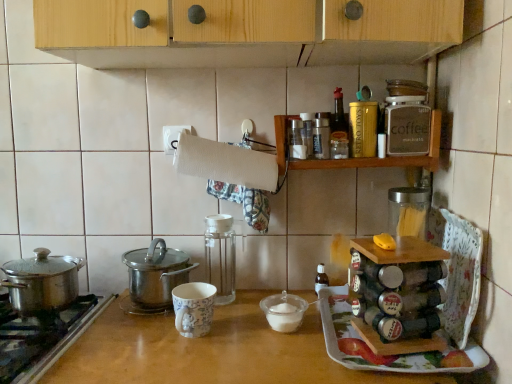
Describe the element at coordinates (398, 294) in the screenshot. The width and height of the screenshot is (512, 384). I see `metallic silver spice rack at center right, which ranks as the second appliance in left-to-right order` at that location.

What is the approximate height of shiny metallic pot at left, positioned as the sixth kitchen appliance in right-to-left order?

shiny metallic pot at left, positioned as the sixth kitchen appliance in right-to-left order, is 7.45 inches tall.

This screenshot has width=512, height=384. Find the location of `white plastic bowl at center, the 2th appliance positioned from the right`. white plastic bowl at center, the 2th appliance positioned from the right is located at coordinates (284, 311).

This screenshot has width=512, height=384. In order to click on porcelain floral mug at center in this screenshot , I will do `click(193, 308)`.

The image size is (512, 384). What do you see at coordinates (226, 163) in the screenshot? I see `white paper towel at upper center` at bounding box center [226, 163].

This screenshot has height=384, width=512. I want to click on metallic silver spice rack at center right, the first appliance when ordered from right to left, so click(398, 294).

From the image's perspective, is clear glass jar at upper right, the first kitchen appliance from the right, positioned above or below white plastic bowl at center, the 1th appliance viewed from the left?

clear glass jar at upper right, the first kitchen appliance from the right, is above white plastic bowl at center, the 1th appliance viewed from the left.

From the image's perspective, which appliance is the 2nd one below the clear glass jar at upper right, the seventh kitchen appliance in the left-to-right sequence? Please provide its 2D coordinates.

[(284, 311)]

Is clear glass jar at upper right, the seventh kitchen appliance in the left-to-right sequence, spatially inside white plastic bowl at center, the 2th appliance positioned from the right, or outside of it?

clear glass jar at upper right, the seventh kitchen appliance in the left-to-right sequence, cannot be found inside white plastic bowl at center, the 2th appliance positioned from the right.

Is clear glass jar at upper right, the first kitchen appliance from the right, positioned before white plastic bowl at center, the 2th appliance positioned from the right?

No.

Does point (330, 145) lie in front of point (195, 160)?

No, (330, 145) is behind (195, 160).

From the image's perspective, is metallic glass spice rack at upper center, which is counted as the 4th kitchen appliance, starting from the right, on white paper towel at upper center?

Yes.

In terms of height, does metallic glass spice rack at upper center, which is counted as the 4th kitchen appliance, starting from the right, look taller or shorter compared to white paper towel at upper center?

Considering their sizes, metallic glass spice rack at upper center, which is counted as the 4th kitchen appliance, starting from the right, has more height than white paper towel at upper center.

Does metallic glass spice rack at upper center, which is counted as the 4th kitchen appliance, starting from the right, have a larger size compared to white paper towel at upper center?

No, metallic glass spice rack at upper center, which is counted as the 4th kitchen appliance, starting from the right, is not bigger than white paper towel at upper center.

From the image's perspective, is metallic silver spice rack at center right, the first appliance when ordered from right to left, located beneath matte brown coffee container at upper right, placed as the second kitchen appliance when sorted from right to left?

Yes.

Is metallic silver spice rack at center right, the first appliance when ordered from right to left, at the right side of matte brown coffee container at upper right, which appears as the 6th kitchen appliance when viewed from the left?

No.

Who is taller, metallic silver spice rack at center right, which ranks as the second appliance in left-to-right order, or matte brown coffee container at upper right, which appears as the 6th kitchen appliance when viewed from the left?

With more height is metallic silver spice rack at center right, which ranks as the second appliance in left-to-right order.

Considering the relative sizes of metallic silver spice rack at center right, which ranks as the second appliance in left-to-right order, and matte brown coffee container at upper right, placed as the second kitchen appliance when sorted from right to left, in the image provided, is metallic silver spice rack at center right, which ranks as the second appliance in left-to-right order, wider than matte brown coffee container at upper right, placed as the second kitchen appliance when sorted from right to left,?

Yes.

From a real-world perspective, which is physically below, white paper towel at upper center or matte brown coffee container at upper right, which appears as the 6th kitchen appliance when viewed from the left?

In real-world perspective, white paper towel at upper center is lower.

Based on the photo, does white paper towel at upper center turn towards matte brown coffee container at upper right, placed as the second kitchen appliance when sorted from right to left?

No, white paper towel at upper center is not aimed at matte brown coffee container at upper right, placed as the second kitchen appliance when sorted from right to left.

From the image's perspective, count 2nd kitchen appliances upward from the white paper towel at upper center and point to it. Please provide its 2D coordinates.

[(407, 126)]

How different are the orientations of white paper towel at upper center and matte brown coffee container at upper right, placed as the second kitchen appliance when sorted from right to left, in degrees?

The facing directions of white paper towel at upper center and matte brown coffee container at upper right, placed as the second kitchen appliance when sorted from right to left, are 1.45 degrees apart.

Is the surface of metallic glass spice rack at upper center, which ranks as the 4th kitchen appliance in left-to-right order, in direct contact with porcelain floral mug at center?

No, metallic glass spice rack at upper center, which ranks as the 4th kitchen appliance in left-to-right order, is not touching porcelain floral mug at center.

Is metallic glass spice rack at upper center, which is counted as the 4th kitchen appliance, starting from the right, at the right side of porcelain floral mug at center?

Yes, metallic glass spice rack at upper center, which is counted as the 4th kitchen appliance, starting from the right, is to the right of porcelain floral mug at center.

From the image's perspective, is metallic glass spice rack at upper center, which is counted as the 4th kitchen appliance, starting from the right, above porcelain floral mug at center?

Yes, from the image's perspective, metallic glass spice rack at upper center, which is counted as the 4th kitchen appliance, starting from the right, is above porcelain floral mug at center.

Which is correct: metallic glass spice rack at upper center, which ranks as the 4th kitchen appliance in left-to-right order, is inside porcelain floral mug at center, or outside of it?

metallic glass spice rack at upper center, which ranks as the 4th kitchen appliance in left-to-right order, is not inside porcelain floral mug at center, it's outside.

Between metallic glass spice rack at upper center, which ranks as the 4th kitchen appliance in left-to-right order, and gold metallic canister at upper center, marked as the third kitchen appliance in a right-to-left arrangement, which one has more height?

With more height is metallic glass spice rack at upper center, which ranks as the 4th kitchen appliance in left-to-right order.

From the picture: How different are the orientations of metallic glass spice rack at upper center, which ranks as the 4th kitchen appliance in left-to-right order, and gold metallic canister at upper center, the fifth kitchen appliance when ordered from left to right, in degrees?

There is a 0.478-degree angle between the facing directions of metallic glass spice rack at upper center, which ranks as the 4th kitchen appliance in left-to-right order, and gold metallic canister at upper center, the fifth kitchen appliance when ordered from left to right.

Is metallic glass spice rack at upper center, which ranks as the 4th kitchen appliance in left-to-right order, beside gold metallic canister at upper center, the fifth kitchen appliance when ordered from left to right?

Yes, metallic glass spice rack at upper center, which ranks as the 4th kitchen appliance in left-to-right order, and gold metallic canister at upper center, the fifth kitchen appliance when ordered from left to right, clearly make contact.

Looking at this image, is metallic glass spice rack at upper center, which ranks as the 4th kitchen appliance in left-to-right order, to the right of polished stainless steel pot at left, which appears as the first kitchen appliance when viewed from the left, from the viewer's perspective?

Indeed, metallic glass spice rack at upper center, which ranks as the 4th kitchen appliance in left-to-right order, is positioned on the right side of polished stainless steel pot at left, which appears as the first kitchen appliance when viewed from the left.

Is metallic glass spice rack at upper center, which ranks as the 4th kitchen appliance in left-to-right order, turned away from polished stainless steel pot at left, the 7th kitchen appliance viewed from the right?

No.

The width and height of the screenshot is (512, 384). I want to click on the 3rd kitchen appliance to the left of the metallic glass spice rack at upper center, which is counted as the 4th kitchen appliance, starting from the right, starting your count from the anchor, so click(x=42, y=281).

Which object is wider, metallic glass spice rack at upper center, which ranks as the 4th kitchen appliance in left-to-right order, or polished stainless steel pot at left, the 7th kitchen appliance viewed from the right?

Wider between the two is polished stainless steel pot at left, the 7th kitchen appliance viewed from the right.

The height and width of the screenshot is (384, 512). Find the location of `the 1st kitchen appliance behind the white plastic bowl at center, the 2th appliance positioned from the right, starting your count from the anchor`. the 1st kitchen appliance behind the white plastic bowl at center, the 2th appliance positioned from the right, starting your count from the anchor is located at coordinates (405, 88).

This screenshot has height=384, width=512. Identify the location of kitchen appliance that is the 3rd one when counting upward from the white paper towel at upper center (from the image's perspective). (339, 129).

Estimate the real-world distances between objects in this image. Which object is closer to wooden spice rack at upper right, clear glass jar at upper right, the first kitchen appliance from the right, or white paper towel at upper center?

white paper towel at upper center lies closer to wooden spice rack at upper right than the other object.

Based on their spatial positions, is metallic silver spice rack at center right, which ranks as the second appliance in left-to-right order, or white paper towel at upper center further from stainless steel gas stove at lower left?

metallic silver spice rack at center right, which ranks as the second appliance in left-to-right order, is positioned further to the anchor stainless steel gas stove at lower left.

Estimate the real-world distances between objects in this image. Which object is further from shiny metallic pot at left, positioned as the sixth kitchen appliance in right-to-left order, clear glass jar at upper right, the first kitchen appliance from the right, or transparent glass spice rack at center, which is the 3th kitchen appliance from left to right?

The object further to shiny metallic pot at left, positioned as the sixth kitchen appliance in right-to-left order, is clear glass jar at upper right, the first kitchen appliance from the right.

From the image, which object appears to be nearer to white paper towel at upper center, gold metallic canister at upper center, the fifth kitchen appliance when ordered from left to right, or polished stainless steel pot at left, which appears as the first kitchen appliance when viewed from the left?

Based on the image, gold metallic canister at upper center, the fifth kitchen appliance when ordered from left to right, appears to be nearer to white paper towel at upper center.

Which object lies further to the anchor point gold metallic canister at upper center, marked as the third kitchen appliance in a right-to-left arrangement, white paper towel at upper center or porcelain floral mug at center?

porcelain floral mug at center lies further to gold metallic canister at upper center, marked as the third kitchen appliance in a right-to-left arrangement, than the other object.

From the image, which object appears to be nearer to metallic silver spice rack at center right, the first appliance when ordered from right to left, porcelain floral mug at center or gold metallic canister at upper center, marked as the third kitchen appliance in a right-to-left arrangement?

The object closer to metallic silver spice rack at center right, the first appliance when ordered from right to left, is gold metallic canister at upper center, marked as the third kitchen appliance in a right-to-left arrangement.

From the picture: Estimate the real-world distances between objects in this image. Which object is closer to stainless steel gas stove at lower left, gold metallic canister at upper center, the fifth kitchen appliance when ordered from left to right, or clear glass jar at upper right, the seventh kitchen appliance in the left-to-right sequence?

Among the two, gold metallic canister at upper center, the fifth kitchen appliance when ordered from left to right, is located nearer to stainless steel gas stove at lower left.

From the image, which object appears to be farther from metallic silver spice rack at center right, the first appliance when ordered from right to left, transparent glass spice rack at center, which is the 3th kitchen appliance from left to right, or clear glass jar at upper right, the first kitchen appliance from the right?

clear glass jar at upper right, the first kitchen appliance from the right.

This screenshot has height=384, width=512. What are the coordinates of `shelf between porcelain floral mug at center and matte brown coffee container at upper right, placed as the second kitchen appliance when sorted from right to left, from left to right` in the screenshot? It's located at (384, 158).

Find the location of `shelf between shiny metallic pot at left, marked as the second kitchen appliance in a left-to-right arrangement, and metallic silver spice rack at center right, which ranks as the second appliance in left-to-right order, in the horizontal direction`. shelf between shiny metallic pot at left, marked as the second kitchen appliance in a left-to-right arrangement, and metallic silver spice rack at center right, which ranks as the second appliance in left-to-right order, in the horizontal direction is located at coordinates (384, 158).

In order to click on shelf located between transparent glass spice rack at center, which is the 5th kitchen appliance in right-to-left order, and metallic silver spice rack at center right, the first appliance when ordered from right to left, in the left-right direction in this screenshot , I will do `click(384, 158)`.

I want to click on toilet paper between stainless steel gas stove at lower left and white plastic bowl at center, the 2th appliance positioned from the right, in the horizontal direction, so click(226, 163).